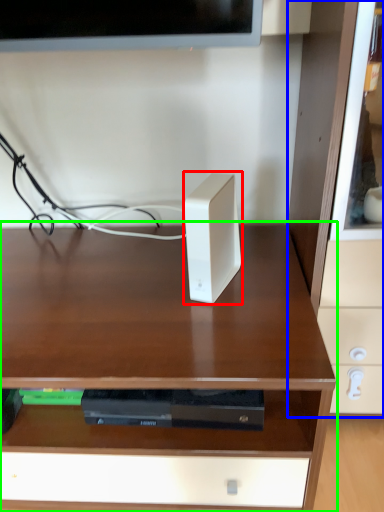
Question: Estimate the real-world distances between objects in this image. Which object is farther from ipod (highlighted by a red box), dresser (highlighted by a blue box) or desk (highlighted by a green box)?

Choices:
 (A) dresser
 (B) desk

Answer: (A)